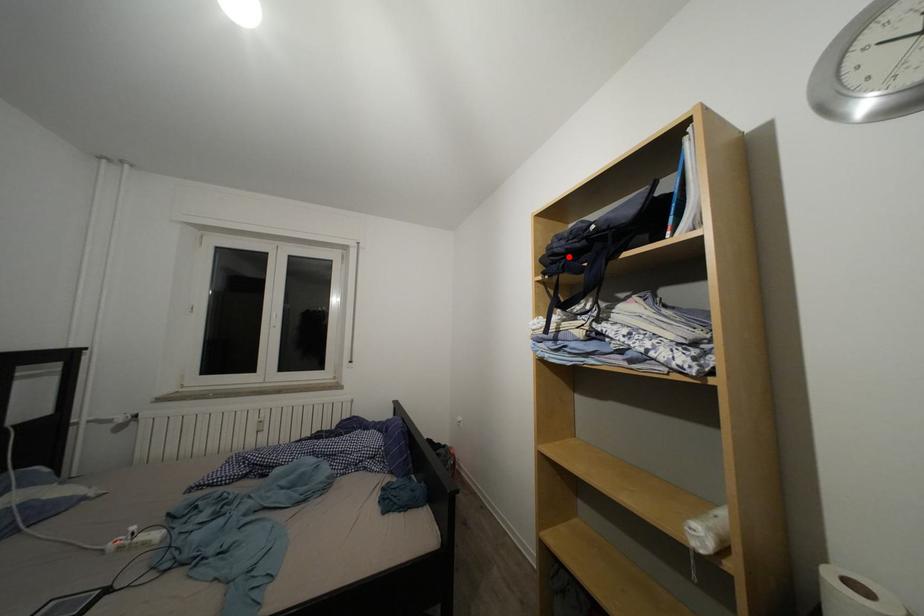
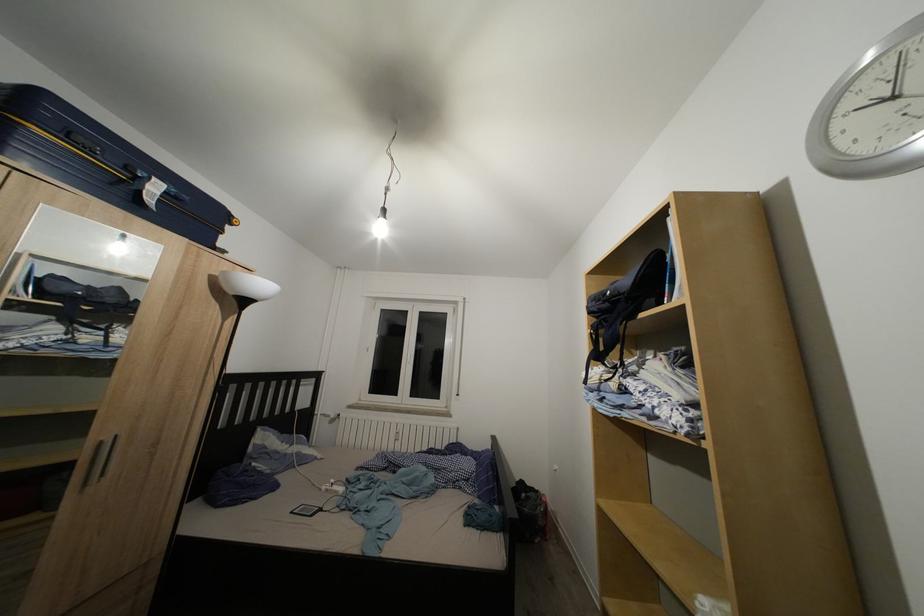
In the second image, find the point that corresponds to the highlighted location in the first image.

(602, 315)